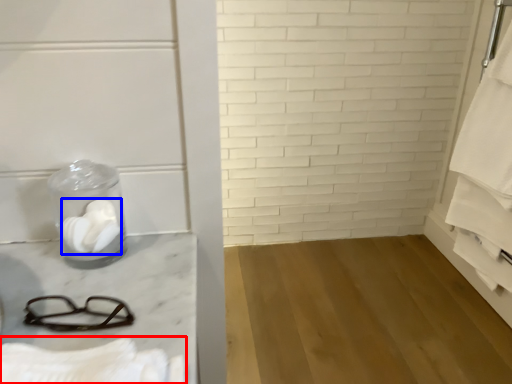
Question: Which object appears farthest to the camera in this image, bath towel (highlighted by a red box) or toilet paper (highlighted by a blue box)?

Choices:
 (A) bath towel
 (B) toilet paper

Answer: (B)